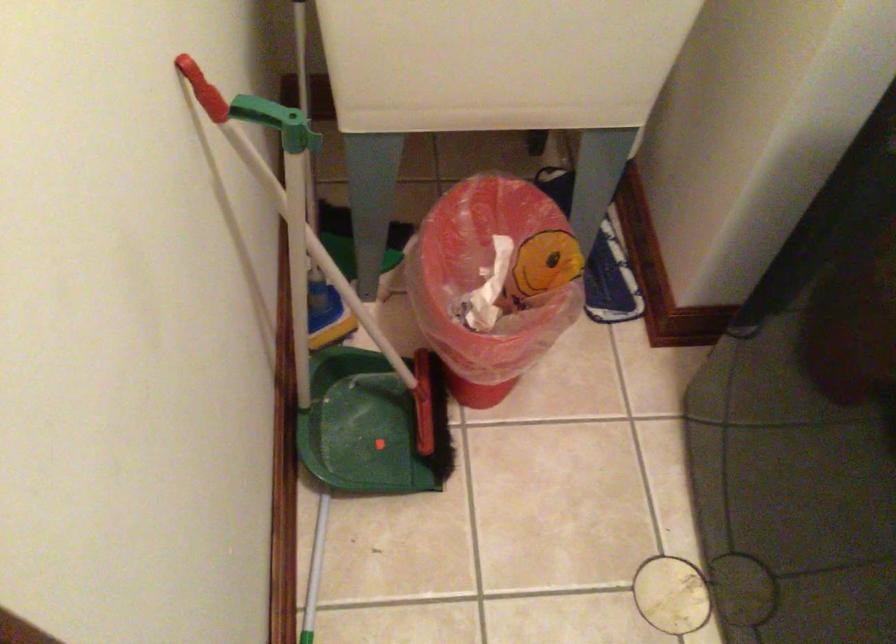
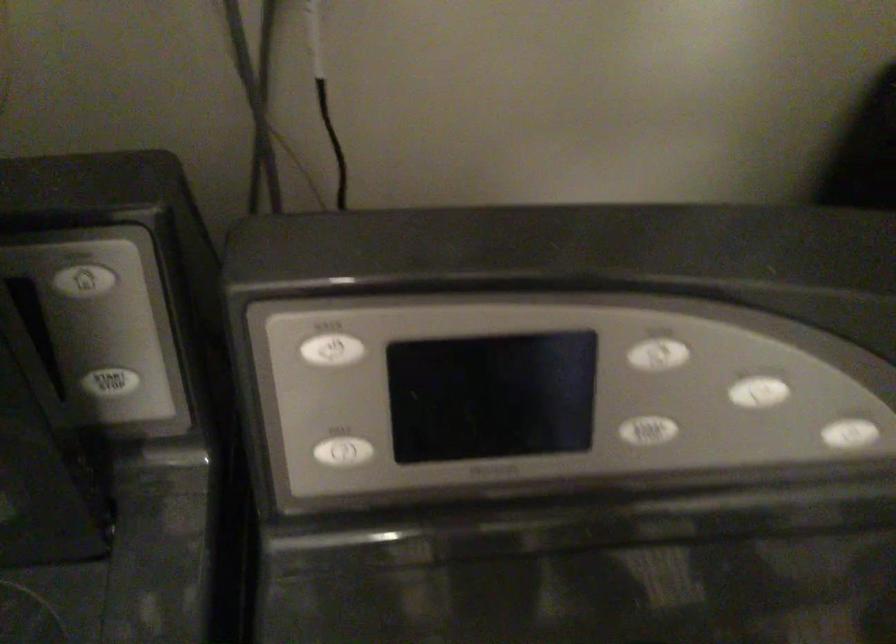
First-person continuous shooting, in which direction is the camera rotating?

The camera's rotation is toward right-down.